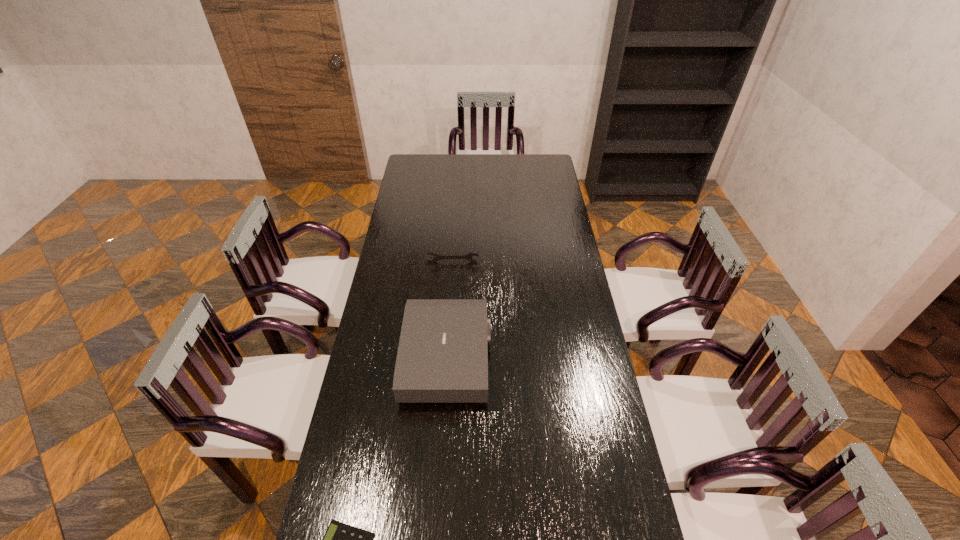
Find the location of a particular element. the tallest object is located at coordinates (442, 357).

Image resolution: width=960 pixels, height=540 pixels. I want to click on projector, so click(442, 357).

The width and height of the screenshot is (960, 540). Identify the location of the second shortest object. (437, 256).

You are a GUI agent. You are given a task and a screenshot of the screen. Output one action in this format:
    pyautogui.click(x=<x>, y=<y>)
    Task: Click on the wrench
    
    Given the screenshot: What is the action you would take?
    pos(437,256)

You are a GUI agent. You are given a task and a screenshot of the screen. Output one action in this format:
    pyautogui.click(x=<x>, y=<y>)
    Task: Click on the vacant point located on the front-facing side of the projector
    The height and width of the screenshot is (540, 960).
    Given the screenshot: What is the action you would take?
    pyautogui.click(x=534, y=359)

Identify the location of vacant space located on the open ends of the farthest object. The width and height of the screenshot is (960, 540). click(x=449, y=309).

This screenshot has height=540, width=960. Identify the location of object that is at the left edge. (442, 357).

Identify the location of vacant space at the far edge. Image resolution: width=960 pixels, height=540 pixels. (468, 175).

Locate an element on the screen. vacant position at the left edge of the desktop is located at coordinates (337, 457).

In the image, there is a desktop. Find the location of `free space at the right edge`. free space at the right edge is located at coordinates (562, 218).